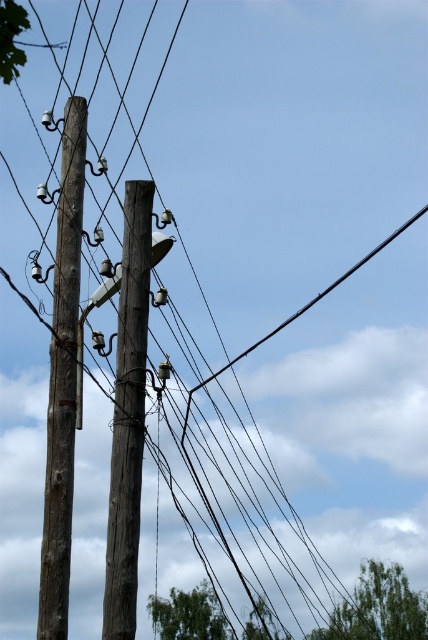
You are a worker inspecting two wooden telegraph poles. You see the wooden telegraph pole at left and the brown wooden telegraph pole at center. Which pole is located more to the left side?

The wooden telegraph pole at left is more to the left side than the brown wooden telegraph pole at center.

You are a bird looking for a perch. You see the wooden telegraph pole at left and the brown wooden telegraph pole at center. Which pole is higher up in the sky?

The wooden telegraph pole at left is above the brown wooden telegraph pole at center, so it is higher up in the sky.

You are a bird looking for a higher perch. You see the wooden telegraph pole at left and the brown wooden telegraph pole at center. Which pole should you choose to get a higher vantage point?

The wooden telegraph pole at left is taller than the brown wooden telegraph pole at center, so the bird should choose the wooden telegraph pole at left for a higher vantage point.